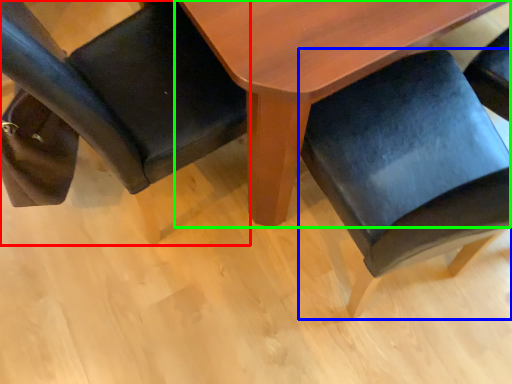
Question: Estimate the real-world distances between objects in this image. Which object is farther from chair (highlighted by a red box), chair (highlighted by a blue box) or table (highlighted by a green box)?

Choices:
 (A) chair
 (B) table

Answer: (A)